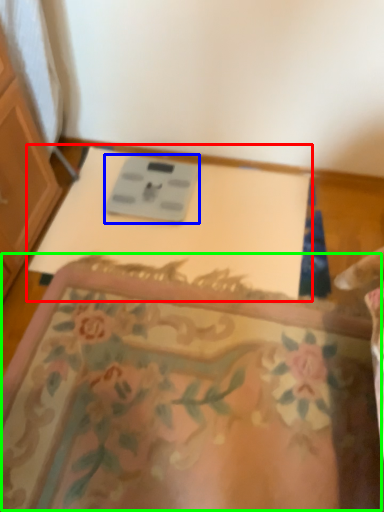
Question: Which object is positioned farthest from changing table (highlighted by a red box)? Select from scale (highlighted by a blue box) and mat (highlighted by a green box).

Choices:
 (A) scale
 (B) mat

Answer: (B)